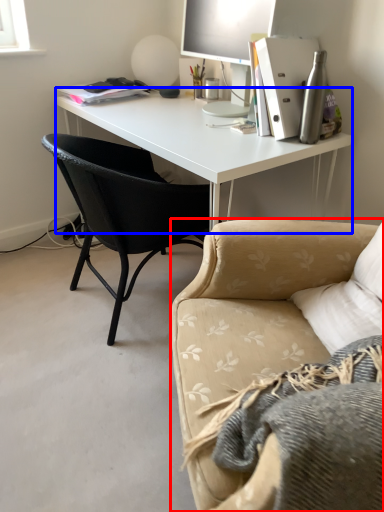
Question: Which of the following is the closest to the observer, studio couch (highlighted by a red box) or desk (highlighted by a blue box)?

Choices:
 (A) studio couch
 (B) desk

Answer: (A)